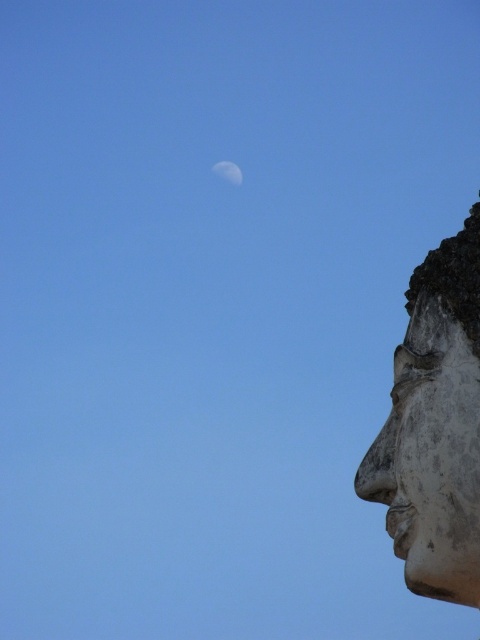
You are an astronomer observing the night sky and see the white stone face at right and the white glossy moon at upper center. Which object is positioned higher in the sky?

The white glossy moon at upper center is positioned higher in the sky than the white stone face at right.

You are an astronomer observing the sky and the sculpture in the scene. Which object, the white stone face at right or the white glossy moon at upper center, appears closer to you?

The white stone face at right appears closer because it is positioned in front of the white glossy moon at upper center.

You are an artist trying to sketch the scene. The white stone face at right and the white glossy moon at upper center are both important elements. Which one should you draw first if you want to ensure proper proportions based on their sizes?

The white stone face at right is larger than the white glossy moon at upper center, so you should draw the white stone face at right first to ensure proper proportions.